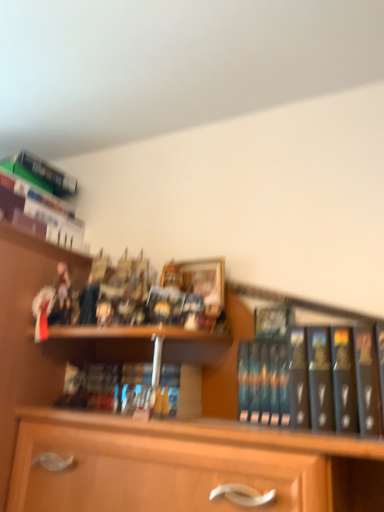
Question: From a real-world perspective, is hardcover book at upper left, acting as the 1th book starting from the left, positioned under wooden figurines at left based on gravity?

Choices:
 (A) yes
 (B) no

Answer: (B)

Question: Does hardcover book at upper left, the third book ordered from the bottom, appear on the left side of wooden figurines at left?

Choices:
 (A) no
 (B) yes

Answer: (A)

Question: Is hardcover book at upper left, which is counted as the first book, starting from the top, closer to the viewer compared to wooden figurines at left?

Choices:
 (A) yes
 (B) no

Answer: (B)

Question: From a real-world perspective, is hardcover book at upper left, the third book ordered from the bottom, over wooden figurines at left?

Choices:
 (A) yes
 (B) no

Answer: (A)

Question: Is hardcover book at upper left, positioned as the 1th book in back-to-front order, directly adjacent to wooden figurines at left?

Choices:
 (A) no
 (B) yes

Answer: (A)

Question: Is hardcover books at center, positioned as the 1th book in bottom-to-top order, bigger or smaller than black matte book at right, which is the 2th book from bottom to top?

Choices:
 (A) big
 (B) small

Answer: (A)

Question: Based on their positions, is hardcover books at center, which is counted as the second book, starting from the right, located to the left or right of black matte book at right, the second book positioned from the top?

Choices:
 (A) right
 (B) left

Answer: (B)

Question: Considering the positions of hardcover books at center, positioned as the 1th book in bottom-to-top order, and black matte book at right, which is the 2th book from bottom to top, in the image, is hardcover books at center, positioned as the 1th book in bottom-to-top order, taller or shorter than black matte book at right, which is the 2th book from bottom to top,?

Choices:
 (A) tall
 (B) short

Answer: (B)

Question: Is hardcover books at center, the second book from the left, wider or thinner than black matte book at right, which is the 2th book from bottom to top?

Choices:
 (A) thin
 (B) wide

Answer: (B)

Question: Relative to hardcover books at center, which is counted as the second book, starting from the right, is wooden figurines at left in front or behind?

Choices:
 (A) front
 (B) behind

Answer: (A)

Question: From a real-world perspective, is wooden figurines at left above or below hardcover books at center, which is counted as the second book, starting from the right?

Choices:
 (A) below
 (B) above

Answer: (A)

Question: Which is correct: wooden figurines at left is inside hardcover books at center, which is counted as the second book, starting from the right, or outside of it?

Choices:
 (A) outside
 (B) inside

Answer: (A)

Question: Does point (51, 266) appear closer or farther from the camera than point (165, 394)?

Choices:
 (A) closer
 (B) farther

Answer: (B)

Question: Is point (69, 192) positioned closer to the camera than point (115, 397)?

Choices:
 (A) farther
 (B) closer

Answer: (A)

Question: From the image's perspective, is hardcover book at upper left, which is counted as the first book, starting from the top, above or below hardcover books at center, the second book when ordered from back to front?

Choices:
 (A) below
 (B) above

Answer: (B)